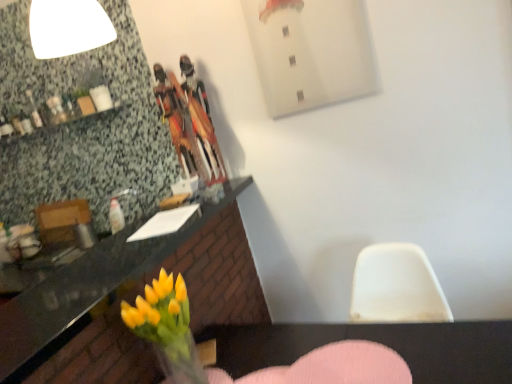
Question: From the image's perspective, is pink fabric armchair at lower center above or below yellow glass vase at lower left?

Choices:
 (A) above
 (B) below

Answer: (B)

Question: Is pink fabric armchair at lower center situated inside yellow glass vase at lower left or outside?

Choices:
 (A) inside
 (B) outside

Answer: (B)

Question: Considering the real-world distances, which object is farthest from the yellow glass vase at lower left?

Choices:
 (A) granite countertop at lower left
 (B) pink fabric armchair at lower center

Answer: (B)

Question: Considering the real-world distances, which object is farthest from the yellow glass vase at lower left?

Choices:
 (A) pink fabric armchair at lower center
 (B) granite countertop at lower left

Answer: (A)